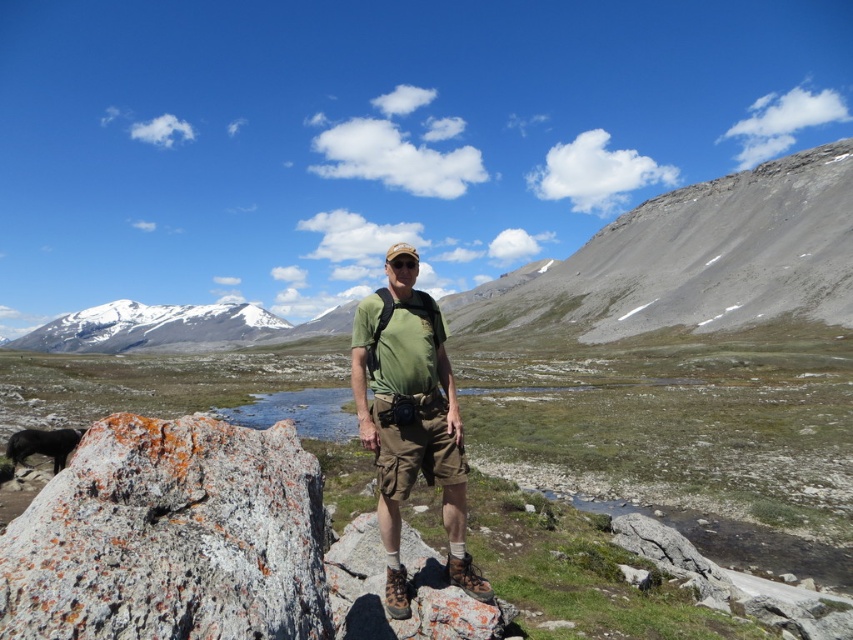
Question: Can you confirm if speckled gray rock at lower left is positioned to the right of snowy granite mountain at upper left?

Choices:
 (A) no
 (B) yes

Answer: (B)

Question: Can you confirm if green matte t-shirt at center is positioned to the left of snowy granite mountain at upper left?

Choices:
 (A) yes
 (B) no

Answer: (B)

Question: Which object is closer to the camera taking this photo?

Choices:
 (A) green matte t-shirt at center
 (B) snowy granite mountain at upper left

Answer: (A)

Question: Can you confirm if speckled gray rock at lower left is wider than snowy granite mountain at upper left?

Choices:
 (A) no
 (B) yes

Answer: (A)

Question: Which point is closer to the camera?

Choices:
 (A) green matte t-shirt at center
 (B) snowy granite mountain at upper left

Answer: (A)

Question: Which of the following is the farthest from the observer?

Choices:
 (A) (152, 326)
 (B) (199, 497)

Answer: (A)